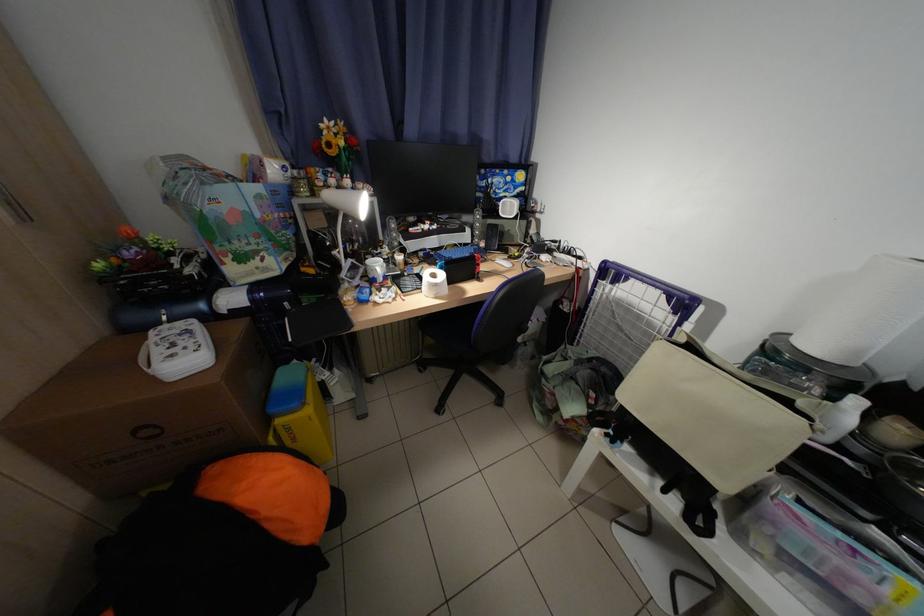
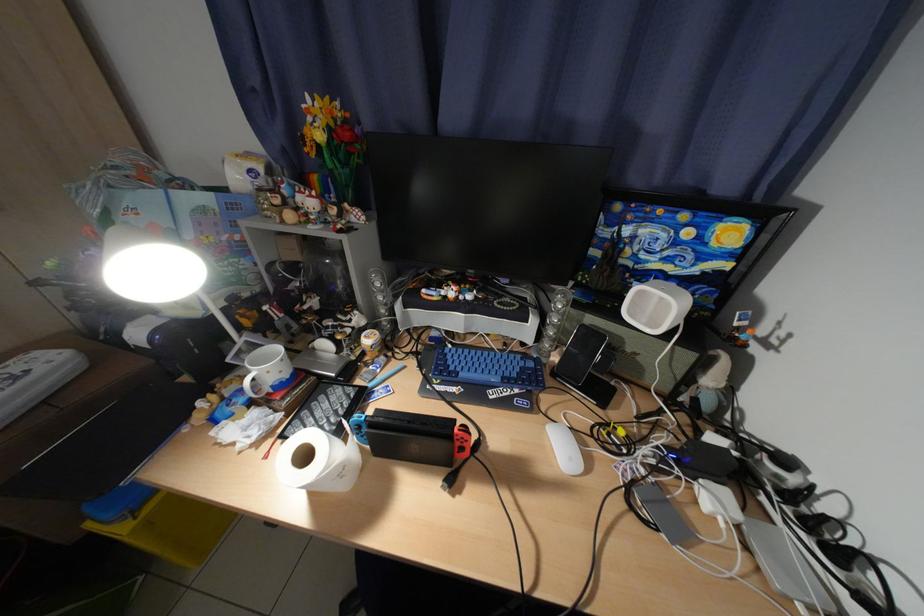
Question: How did the camera likely rotate?

Choices:
 (A) Left
 (B) Right
 (C) Up
 (D) Down

Answer: (A)